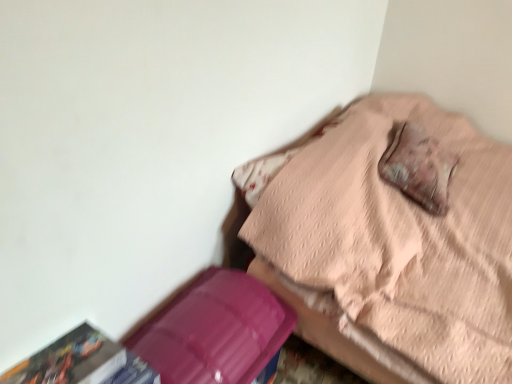
Question: Is pink quilted bed at upper right not near multicolored paper at lower left?

Choices:
 (A) no
 (B) yes

Answer: (A)

Question: Does pink quilted bed at upper right turn towards multicolored paper at lower left?

Choices:
 (A) no
 (B) yes

Answer: (B)

Question: Does pink quilted bed at upper right have a lesser width compared to multicolored paper at lower left?

Choices:
 (A) yes
 (B) no

Answer: (B)

Question: Can you confirm if pink quilted bed at upper right is bigger than multicolored paper at lower left?

Choices:
 (A) yes
 (B) no

Answer: (A)

Question: Is pink quilted bed at upper right further to the viewer compared to multicolored paper at lower left?

Choices:
 (A) no
 (B) yes

Answer: (B)

Question: From a real-world perspective, is multicolored paper at lower left positioned above or below leather-like brown pillow at upper right?

Choices:
 (A) above
 (B) below

Answer: (B)

Question: In terms of size, does multicolored paper at lower left appear bigger or smaller than leather-like brown pillow at upper right?

Choices:
 (A) big
 (B) small

Answer: (B)

Question: From the image's perspective, is multicolored paper at lower left above or below leather-like brown pillow at upper right?

Choices:
 (A) above
 (B) below

Answer: (B)

Question: Which is correct: multicolored paper at lower left is inside leather-like brown pillow at upper right, or outside of it?

Choices:
 (A) inside
 (B) outside

Answer: (B)

Question: Is point [x=194, y=347] closer or farther from the camera than point [x=343, y=334]?

Choices:
 (A) closer
 (B) farther

Answer: (A)

Question: Considering the positions of purple plastic box at lower left and pink quilted bed at upper right in the image, is purple plastic box at lower left wider or thinner than pink quilted bed at upper right?

Choices:
 (A) thin
 (B) wide

Answer: (A)

Question: Visually, is purple plastic box at lower left positioned to the left or to the right of pink quilted bed at upper right?

Choices:
 (A) left
 (B) right

Answer: (A)

Question: From the image's perspective, relative to pink quilted bed at upper right, is purple plastic box at lower left above or below?

Choices:
 (A) above
 (B) below

Answer: (B)

Question: Looking at their shapes, would you say purple plastic box at lower left is wider or thinner than leather-like brown pillow at upper right?

Choices:
 (A) thin
 (B) wide

Answer: (A)

Question: Is purple plastic box at lower left in front of or behind leather-like brown pillow at upper right in the image?

Choices:
 (A) behind
 (B) front

Answer: (B)